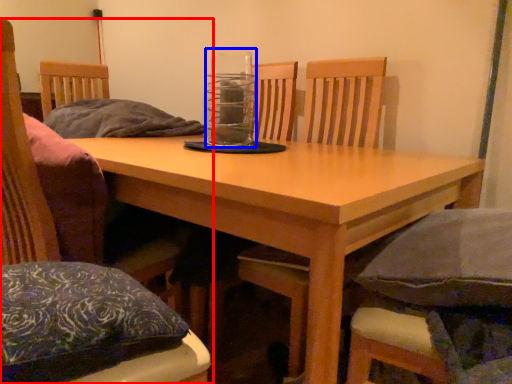
Question: Which of the following is the closest to the observer, chair (highlighted by a red box) or glass jar (highlighted by a blue box)?

Choices:
 (A) chair
 (B) glass jar

Answer: (A)